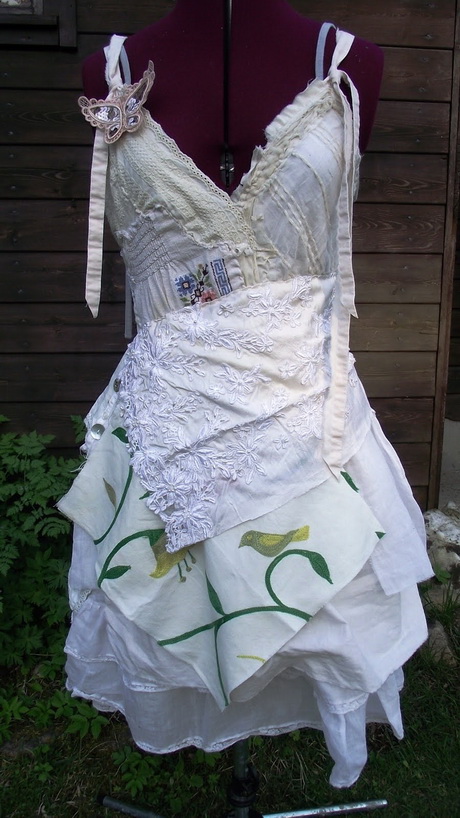
Identify the location of lace. Image resolution: width=460 pixels, height=818 pixels. (180, 153), (217, 189).